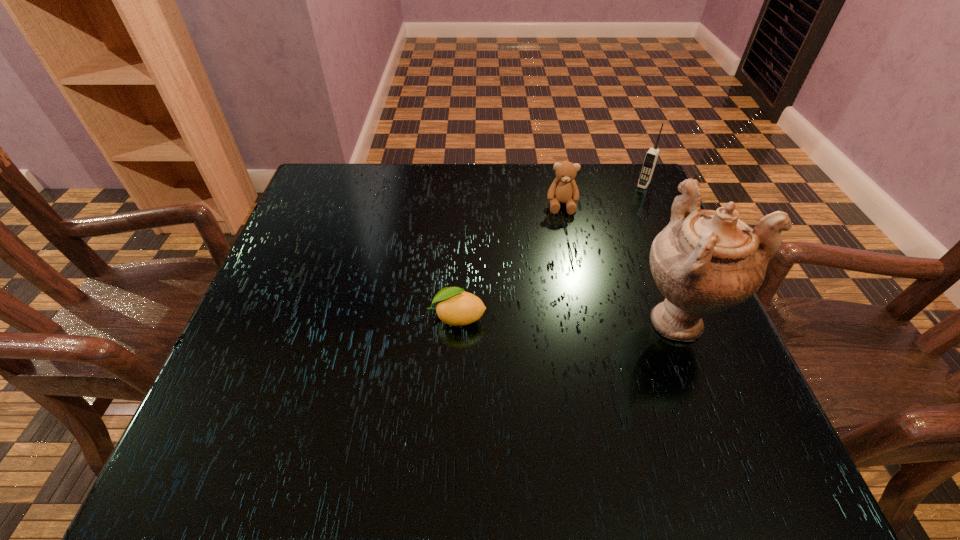
At what (x,y) coordinates should I click in order to perform the action: click on free spot between the third tallest object and the farthest object. Please return your answer as a coordinate pair (x, y). Image resolution: width=960 pixels, height=540 pixels. Looking at the image, I should click on (603, 195).

Locate an element on the screen. unoccupied area between the shortest object and the second farthest object is located at coordinates (510, 261).

This screenshot has height=540, width=960. Find the location of `free space between the lemon and the cellular telephone`. free space between the lemon and the cellular telephone is located at coordinates (550, 251).

Locate an element on the screen. This screenshot has height=540, width=960. free spot between the tallest object and the teddy bear is located at coordinates (619, 262).

This screenshot has width=960, height=540. Find the location of `vacant area that lies between the urn and the lemon`. vacant area that lies between the urn and the lemon is located at coordinates (567, 318).

Choose which object is the nearest neighbor to the shortest object. Please provide its 2D coordinates. Your answer should be formatted as a tuple, i.e. [(x, y)], where the tuple contains the x and y coordinates of a point satisfying the conditions above.

[(704, 261)]

Locate an element on the screen. Image resolution: width=960 pixels, height=540 pixels. object identified as the third closest to the shortest object is located at coordinates (651, 157).

The image size is (960, 540). In order to click on vacant region that satisfies the following two spatial constraints: 1. on the back side of the farthest object; 2. on the left side of the second object from left to right in this screenshot , I will do `click(558, 185)`.

At what (x,y) coordinates should I click in order to perform the action: click on vacant space that satisfies the following two spatial constraints: 1. on the back side of the cellular telephone; 2. on the left side of the urn. Please return your answer as a coordinate pair (x, y). This screenshot has height=540, width=960. Looking at the image, I should click on (624, 185).